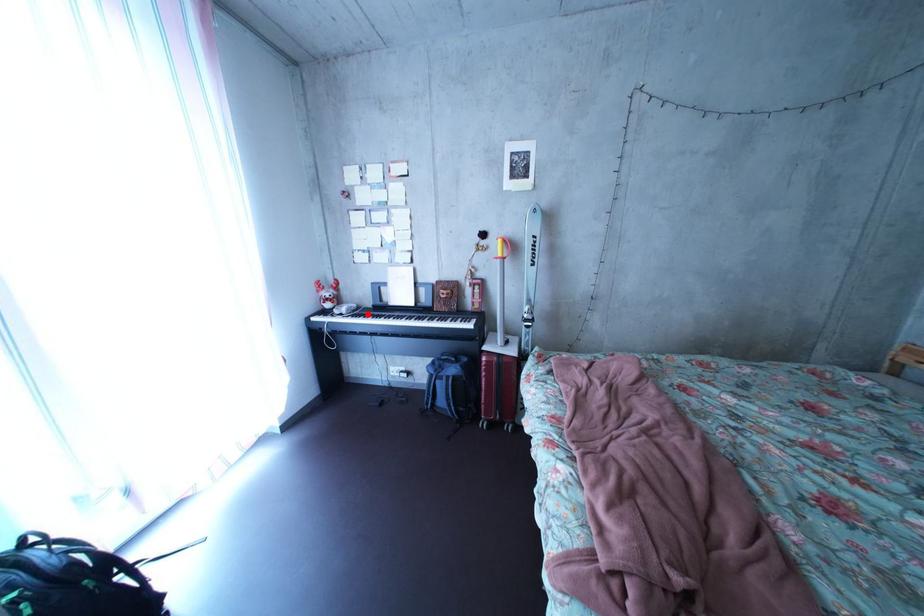
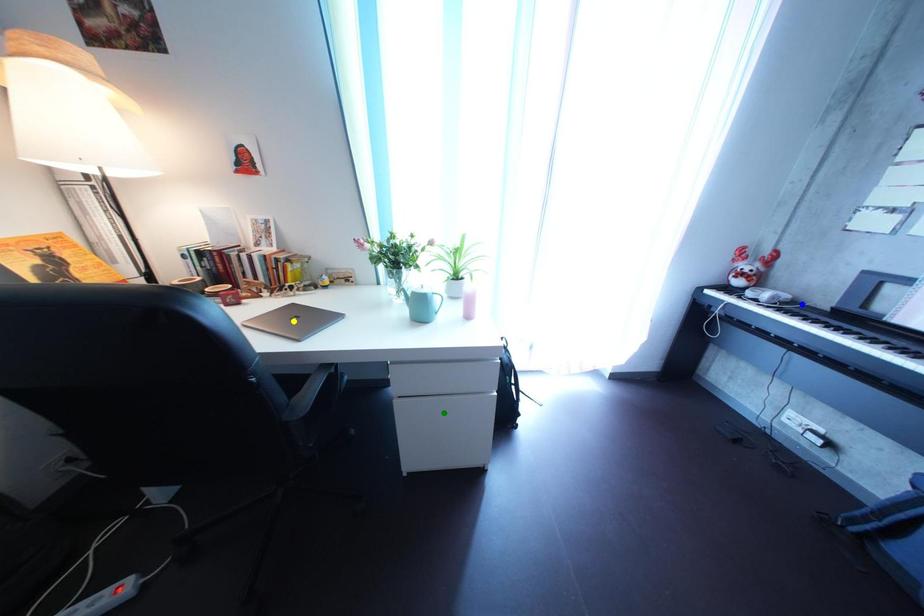
Question: I am providing you with two images of the same scene from different viewpoints. A red point is marked on the first image. You are given multiple points on the second image. Which spot in image 2 lines up with the point in image 1?

Choices:
 (A) green point
 (B) yellow point
 (C) blue point

Answer: (C)